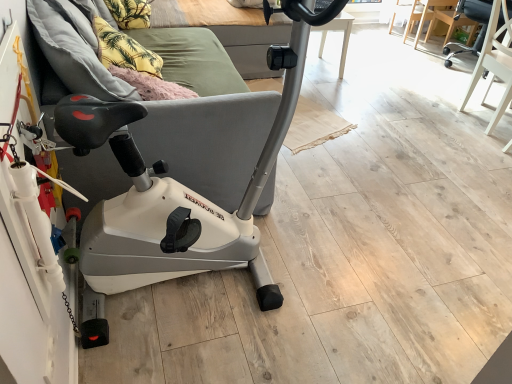
Question: From the image's perspective, is white plastic stationary bicycle at left located above yellow fabric pillow at upper left, the first pillow when ordered from top to bottom?

Choices:
 (A) yes
 (B) no

Answer: (B)

Question: From the image's perspective, does white plastic stationary bicycle at left appear lower than yellow fabric pillow at upper left, the first pillow when ordered from top to bottom?

Choices:
 (A) yes
 (B) no

Answer: (A)

Question: Does white plastic stationary bicycle at left appear on the right side of yellow fabric pillow at upper left, acting as the 2th pillow starting from the bottom?

Choices:
 (A) yes
 (B) no

Answer: (A)

Question: Is yellow fabric pillow at upper left, which appears as the 1th pillow when viewed from the back, a part of white plastic stationary bicycle at left?

Choices:
 (A) yes
 (B) no

Answer: (B)

Question: Is white plastic stationary bicycle at left oriented towards yellow fabric pillow at upper left, the 2th pillow when ordered from front to back?

Choices:
 (A) no
 (B) yes

Answer: (A)

Question: Is white plastic stationary bicycle at left in front of or behind yellow fabric pillow at upper left, the 2th pillow when ordered from front to back, in the image?

Choices:
 (A) behind
 (B) front

Answer: (B)

Question: Is point (192, 228) closer or farther from the camera than point (123, 13)?

Choices:
 (A) farther
 (B) closer

Answer: (B)

Question: From a real-world perspective, is white plastic stationary bicycle at left above or below yellow fabric pillow at upper left, acting as the 2th pillow starting from the bottom?

Choices:
 (A) above
 (B) below

Answer: (A)

Question: Considering the positions of white plastic stationary bicycle at left and yellow fabric pillow at upper left, which appears as the 1th pillow when viewed from the back, in the image, is white plastic stationary bicycle at left taller or shorter than yellow fabric pillow at upper left, which appears as the 1th pillow when viewed from the back,?

Choices:
 (A) tall
 (B) short

Answer: (A)

Question: From their relative heights in the image, would you say matte black chair at upper right, which is the second chair in left-to-right order, is taller or shorter than black leather swivel chair at upper right, acting as the second swivel chair starting from the front?

Choices:
 (A) short
 (B) tall

Answer: (A)

Question: Would you say matte black chair at upper right, the 1th chair when ordered from right to left, is to the left or to the right of black leather swivel chair at upper right, acting as the second swivel chair starting from the front, in the picture?

Choices:
 (A) right
 (B) left

Answer: (B)

Question: In terms of width, does matte black chair at upper right, which is the second chair in left-to-right order, look wider or thinner when compared to black leather swivel chair at upper right, placed as the 1th swivel chair when sorted from back to front?

Choices:
 (A) wide
 (B) thin

Answer: (B)

Question: Relative to black leather swivel chair at upper right, placed as the 1th swivel chair when sorted from back to front, is matte black chair at upper right, the 1th chair when ordered from right to left, in front or behind?

Choices:
 (A) behind
 (B) front

Answer: (A)

Question: Considering the positions of yellow fabric pillow at upper left, acting as the 2th pillow starting from the bottom, and yellow fabric pillow at upper left, positioned as the 2th pillow in back-to-front order, in the image, is yellow fabric pillow at upper left, acting as the 2th pillow starting from the bottom, wider or thinner than yellow fabric pillow at upper left, positioned as the 2th pillow in back-to-front order,?

Choices:
 (A) thin
 (B) wide

Answer: (A)

Question: Relative to yellow fabric pillow at upper left, positioned as the 2th pillow in back-to-front order, is yellow fabric pillow at upper left, which appears as the 1th pillow when viewed from the back, in front or behind?

Choices:
 (A) behind
 (B) front

Answer: (A)